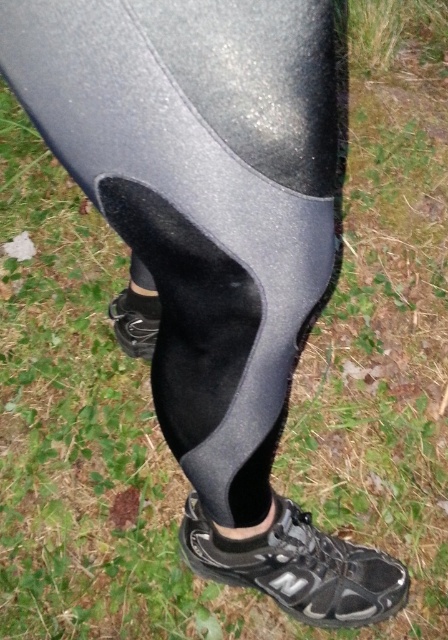
You are trying to choose between two shoes for a hiking trip. You have a pair of black mesh shoe at lower center and a matte black shoe at lower center. Which one would you recommend based on their size?

The black mesh shoe at lower center is bigger than the matte black shoe at lower center, so it would be more comfortable for a hiking trip if you need extra space for your feet.

From the picture: You are a physical therapist examining a patient who has just completed a workout. You notice the black mesh shoe at lower center and the black felt sock at lower center. Which object is closer to the ground?

The black mesh shoe at lower center is positioned under the black felt sock at lower center, so the black mesh shoe at lower center is closer to the ground.